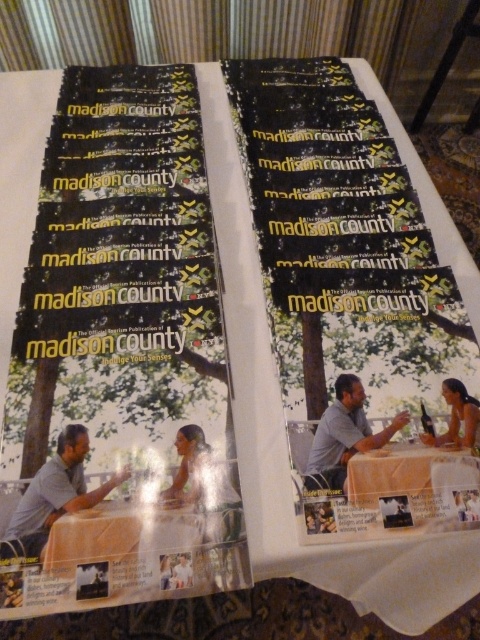
You are a photographer taking a photo of the matte gray shirt at center and the smooth skin person at center. Which object should you focus on first to ensure both are in sharp focus?

You should focus on the matte gray shirt at center first because it is closer to the viewer than the smooth skin person at center. By focusing on the closer object, the depth of field may include the farther object as well, ensuring both are in sharp focus.

You are a photographer who needs to capture a closeup shot of the smooth skin person at center without the gray fabric tablecloth at center appearing in the frame. Is this possible given their sizes?

The gray fabric tablecloth at center is larger in size than the smooth skin person at center. Since the tablecloth is bigger, it might block the view of the person unless you position the camera very close or angle it carefully to avoid the tablecloth edges.

You are organizing a book fair and need to arrange the white plastic table at center and the matte silver hair at center on a limited space. Which object should you place first to maximize space efficiency?

The white plastic table at center occupies less space than the matte silver hair at center, so you should place the matte silver hair at center first to ensure it fits properly before arranging the smaller table.